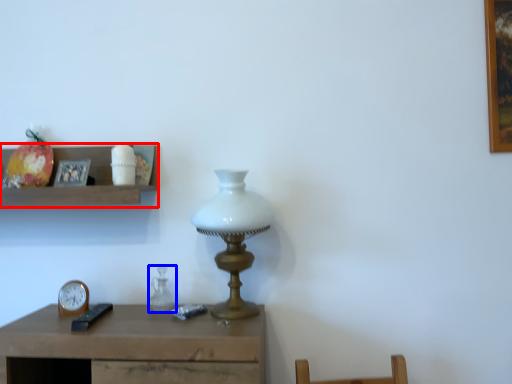
Question: Which object appears farthest to the camera in this image, shelf (highlighted by a red box) or glass vase (highlighted by a blue box)?

Choices:
 (A) shelf
 (B) glass vase

Answer: (B)